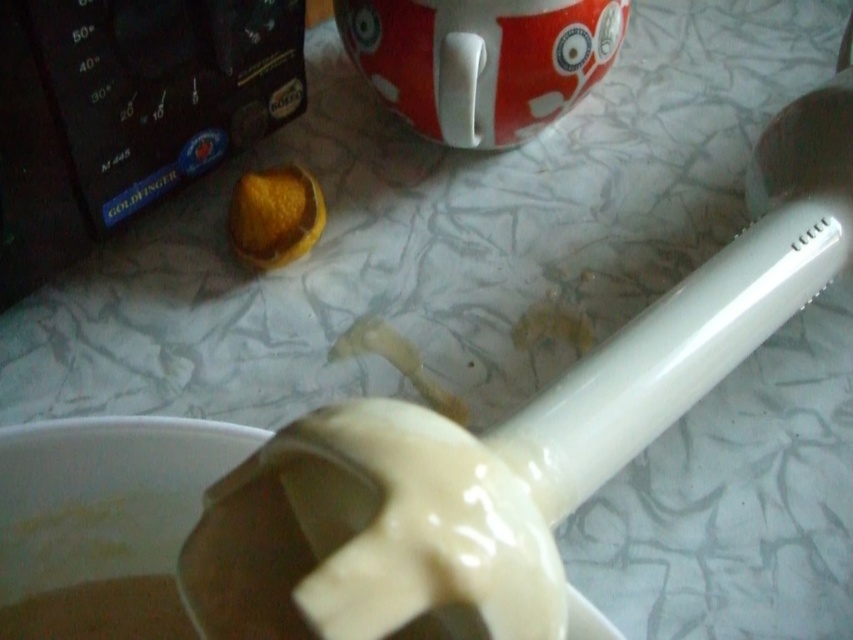
Is white glossy spoon at center smaller than orange peel at center?

Actually, white glossy spoon at center might be larger than orange peel at center.

Image resolution: width=853 pixels, height=640 pixels. I want to click on white glossy spoon at center, so click(x=506, y=445).

Where is `white glossy spoon at center`? white glossy spoon at center is located at coordinates (506, 445).